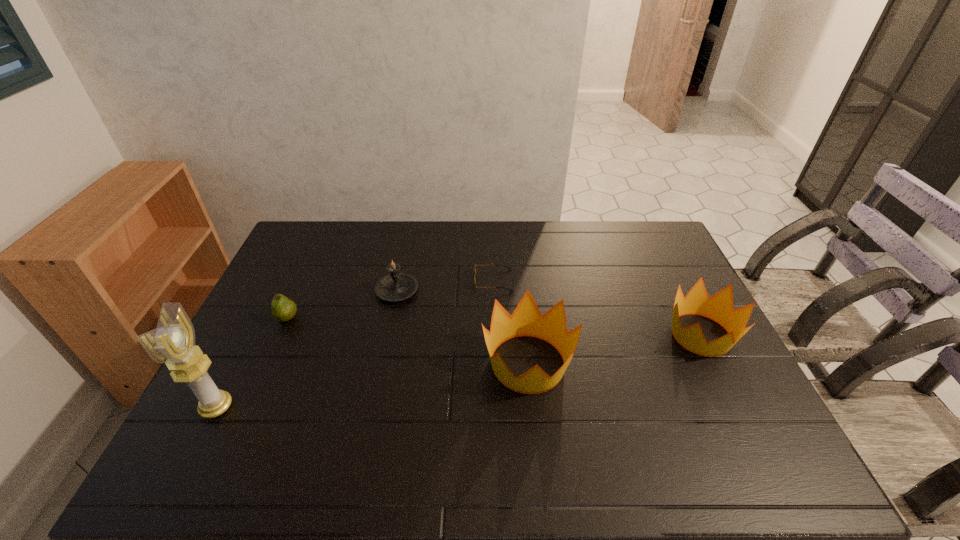
Find the location of a particular element. This screenshot has height=540, width=960. pear at the left edge is located at coordinates (283, 309).

Identify the location of award located at the left edge. The width and height of the screenshot is (960, 540). (172, 343).

At what (x,y) coordinates should I click in order to perform the action: click on object that is at the right edge. Please return your answer as a coordinate pair (x, y). This screenshot has height=540, width=960. Looking at the image, I should click on (719, 307).

What are the coordinates of `object situated at the near left corner` in the screenshot? It's located at (172, 343).

Identify the location of free region at the far edge of the desktop. Image resolution: width=960 pixels, height=540 pixels. pyautogui.click(x=363, y=235).

You are a GUI agent. You are given a task and a screenshot of the screen. Output one action in this format:
    pyautogui.click(x=<x>, y=<y>)
    Task: Click on the blank space at the near edge of the desktop
    The height and width of the screenshot is (540, 960).
    Given the screenshot: What is the action you would take?
    pyautogui.click(x=488, y=428)

Find the location of a particular element. The image size is (960, 540). vacant space at the left edge of the desktop is located at coordinates (295, 287).

Where is `free space at the right edge of the desktop`? free space at the right edge of the desktop is located at coordinates (671, 284).

Find the location of a particular element. The height and width of the screenshot is (540, 960). vacant space at the far right corner of the desktop is located at coordinates (626, 236).

Identify the location of vacant space that's between the fourth object from right to left and the taller crown. (463, 327).